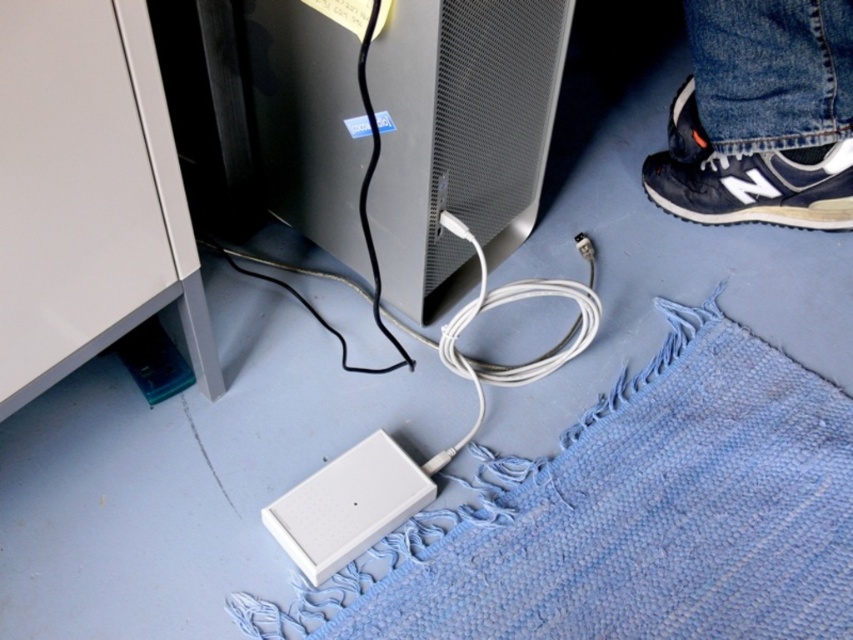
Consider the image. Is satin black monitor at center wider than black leather shoe at lower right?

Yes.

Does satin black monitor at center lie in front of black leather shoe at lower right?

Yes, it is.

Locate an element on the screen. satin black monitor at center is located at coordinates (459, 136).

Find the location of a particular element. The image size is (853, 640). satin black monitor at center is located at coordinates (459, 136).